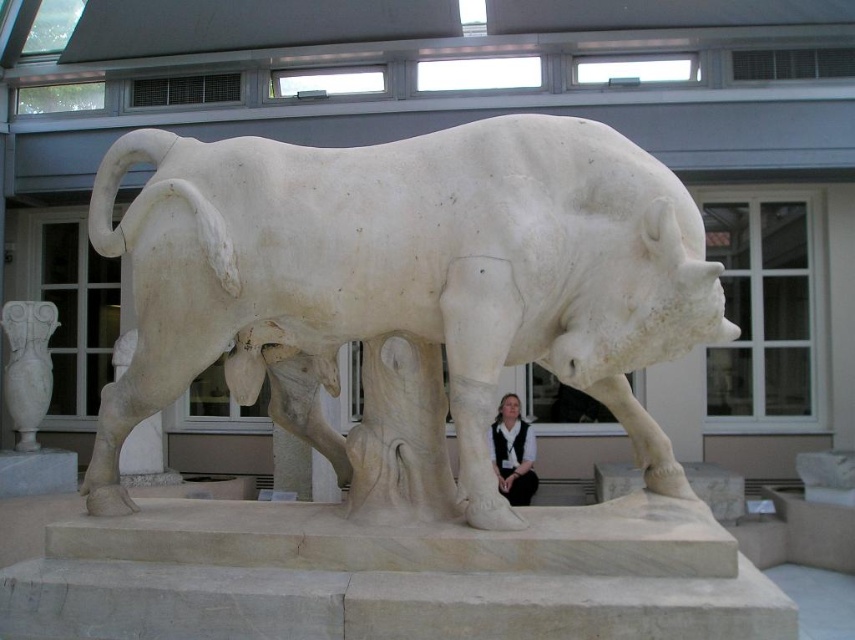
Question: Which object is farther from the camera taking this photo?

Choices:
 (A) white marble bull at center
 (B) white marble vase at left

Answer: (B)

Question: Can you confirm if white marble bull at center is bigger than white marble vase at left?

Choices:
 (A) no
 (B) yes

Answer: (B)

Question: Which object is the closest to the white marble bull at center?

Choices:
 (A) white fabric at lower center
 (B) white marble vase at left

Answer: (A)

Question: Does white marble vase at left have a greater width compared to white fabric at lower center?

Choices:
 (A) yes
 (B) no

Answer: (A)

Question: Can you confirm if white marble bull at center is bigger than white fabric at lower center?

Choices:
 (A) yes
 (B) no

Answer: (A)

Question: Which object appears closest to the camera in this image?

Choices:
 (A) white fabric at lower center
 (B) white marble vase at left
 (C) white marble bull at center

Answer: (C)